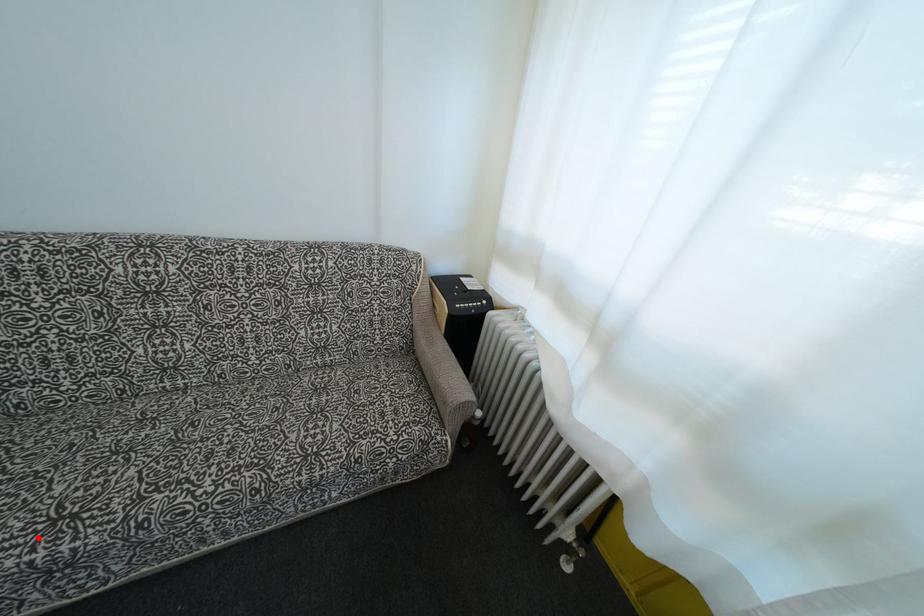
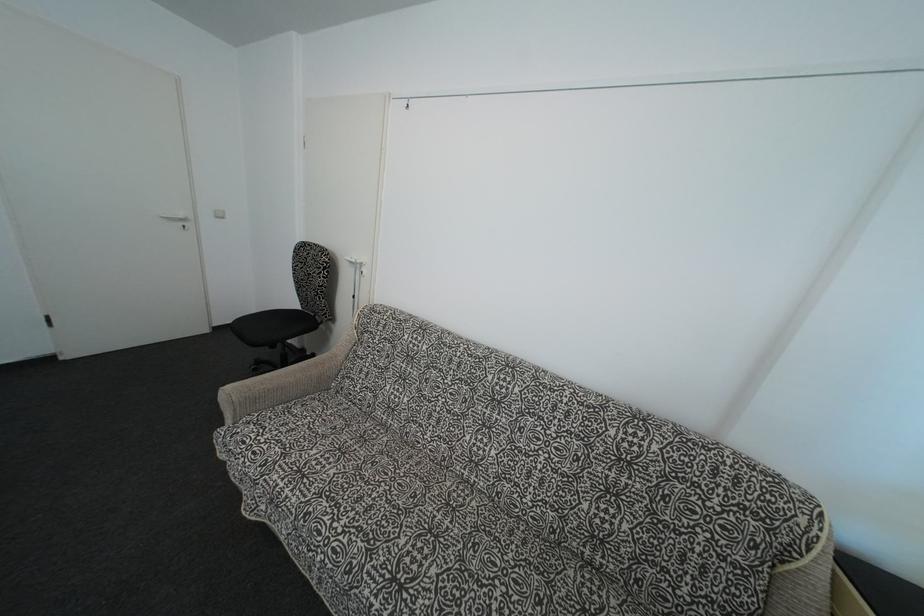
Question: I am providing you with two images of the same scene from different viewpoints. Image1 has a red point marked. In image2, the corresponding 3D location appears at what relative position? Reply with the corresponding letter.

Choices:
 (A) Closer
 (B) Farther

Answer: (B)